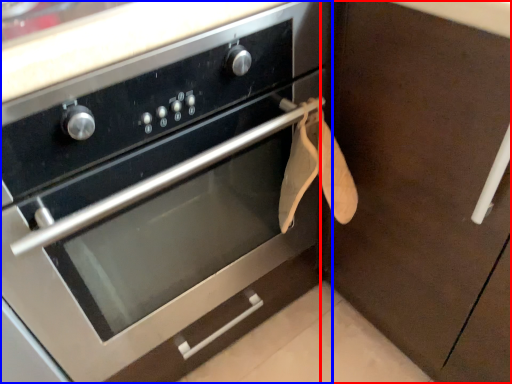
Question: Among these objects, which one is farthest to the camera, cabinetry (highlighted by a red box) or oven (highlighted by a blue box)?

Choices:
 (A) cabinetry
 (B) oven

Answer: (A)